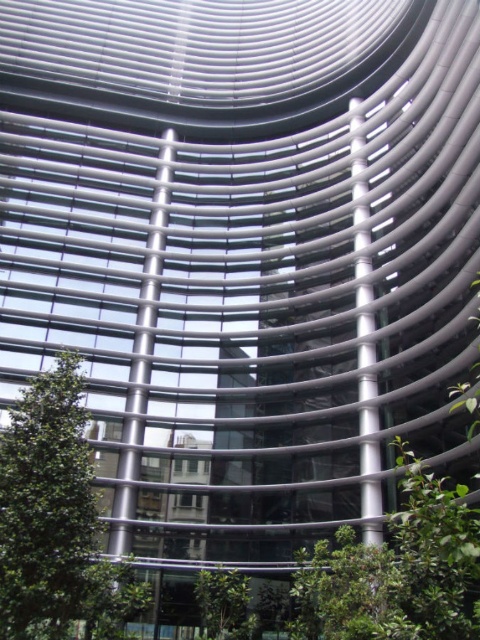
You are standing at the entrance of the metallic structure and notice two green leafy trees in the scene. Which tree is closer to you, the green leafy tree at lower left or the green leafy tree at lower center?

The green leafy tree at lower left is closer to you because it is positioned over the green leafy tree at lower center, indicating it is in front.

You are standing at the entrance of the curved metallic beams structure and see the green leafy tree at lower left and the green leafy tree at lower center. Which tree is positioned more to the left side?

The green leafy tree at lower left is positioned more to the left side than the green leafy tree at lower center.

You are a landscape architect planning to install a new pathway between the green leafy tree at lower left and the green leafy tree at lower center. The pathway will be 3 meters long. Will the pathway fit between them?

The distance between the green leafy tree at lower left and the green leafy tree at lower center is 3.19 meters. Since the pathway is 3 meters long, it will fit between them with some space remaining.